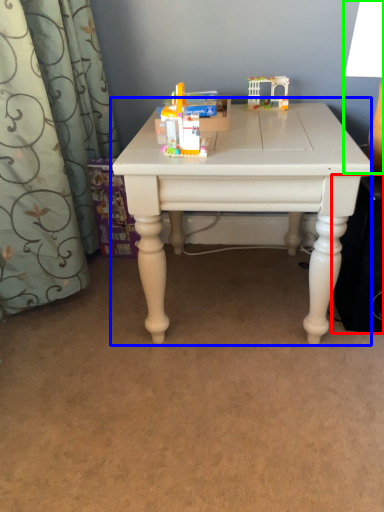
Question: Based on their relative distances, which object is farther from speaker (highlighted by a red box)? Choose from table (highlighted by a blue box) and table lamp (highlighted by a green box).

Choices:
 (A) table
 (B) table lamp

Answer: (B)